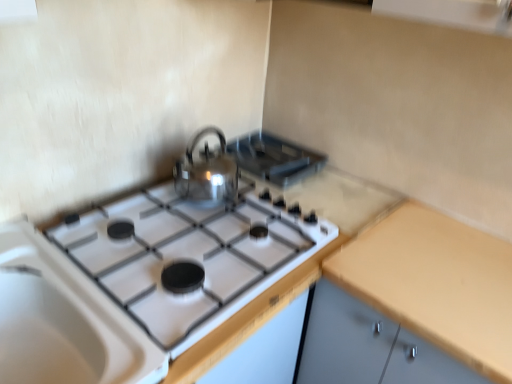
I want to click on free space above yellow matte countertop at right (from a real-world perspective), so click(x=446, y=258).